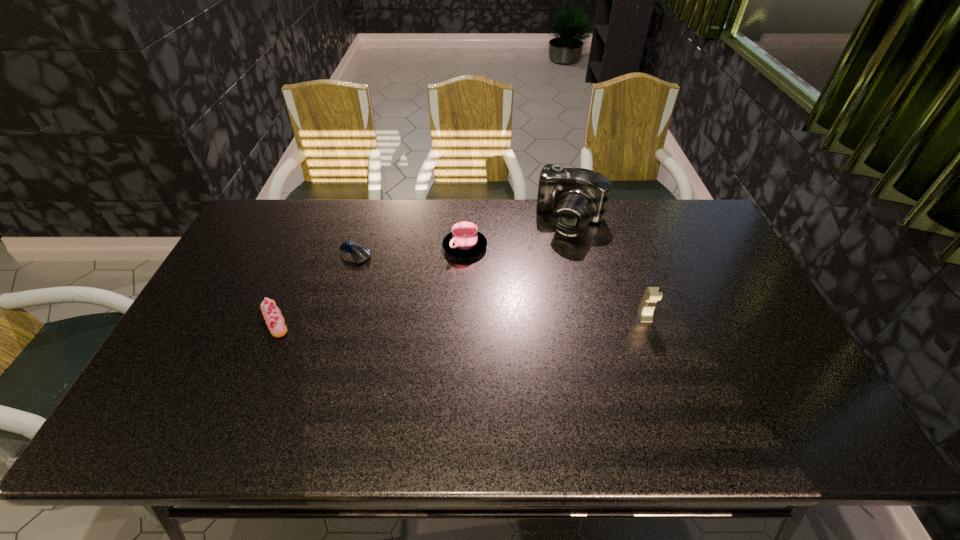
The width and height of the screenshot is (960, 540). Find the location of `free point that satisfies the following two spatial constraints: 1. on the back side of the computer mouse; 2. on the right side of the camera`. free point that satisfies the following two spatial constraints: 1. on the back side of the computer mouse; 2. on the right side of the camera is located at coordinates (365, 220).

Identify the location of vacant space that satisfies the following two spatial constraints: 1. on the back side of the computer mouse; 2. on the right side of the second object from right to left. This screenshot has height=540, width=960. (365, 220).

Locate an element on the screen. The image size is (960, 540). vacant space that satisfies the following two spatial constraints: 1. on the back side of the fourth object from right to left; 2. on the left side of the third tallest object is located at coordinates (357, 247).